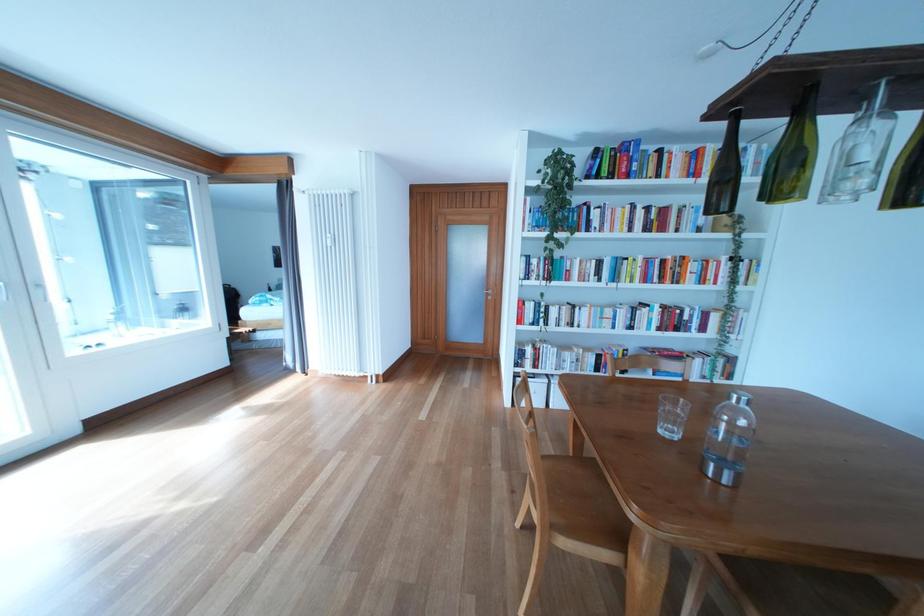
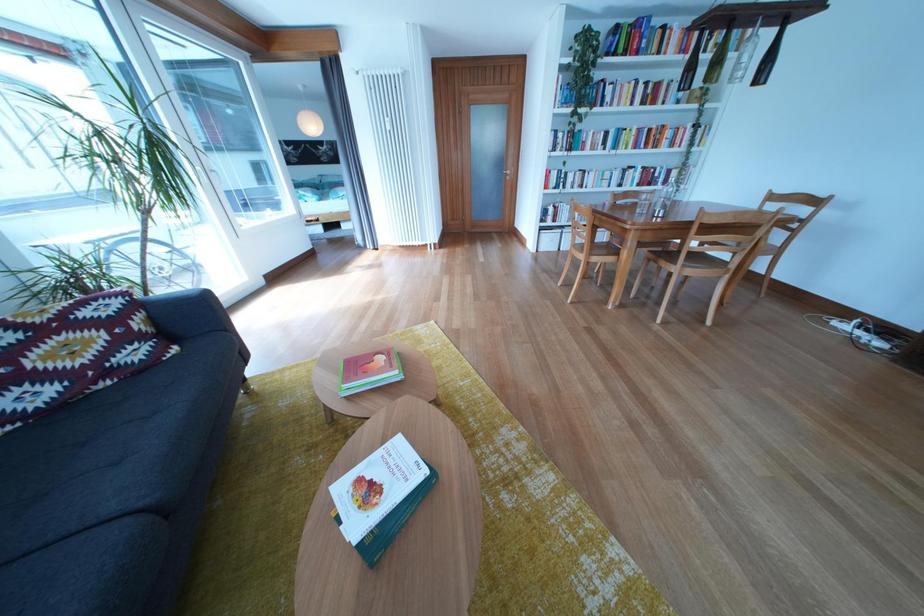
In a continuous first-person perspective shot, in which direction is the camera moving?

The cameraman moved toward left, backward.